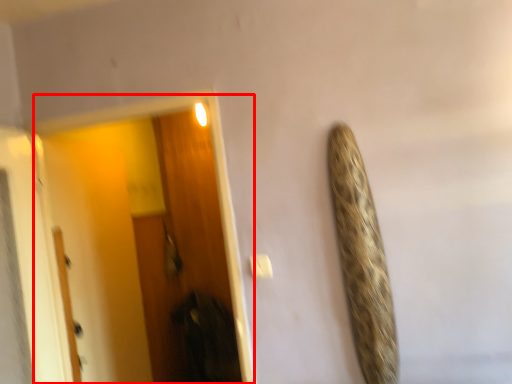
Question: From the image's perspective, considering the relative positions of screen door (annotated by the red box) and door in the image provided, where is screen door (annotated by the red box) located with respect to the staircase?

Choices:
 (A) above
 (B) below

Answer: (A)